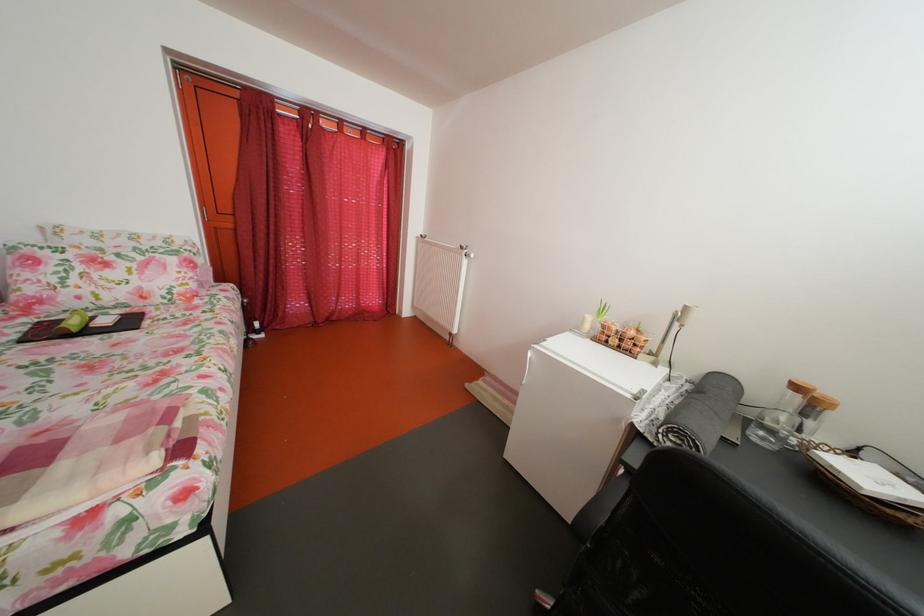
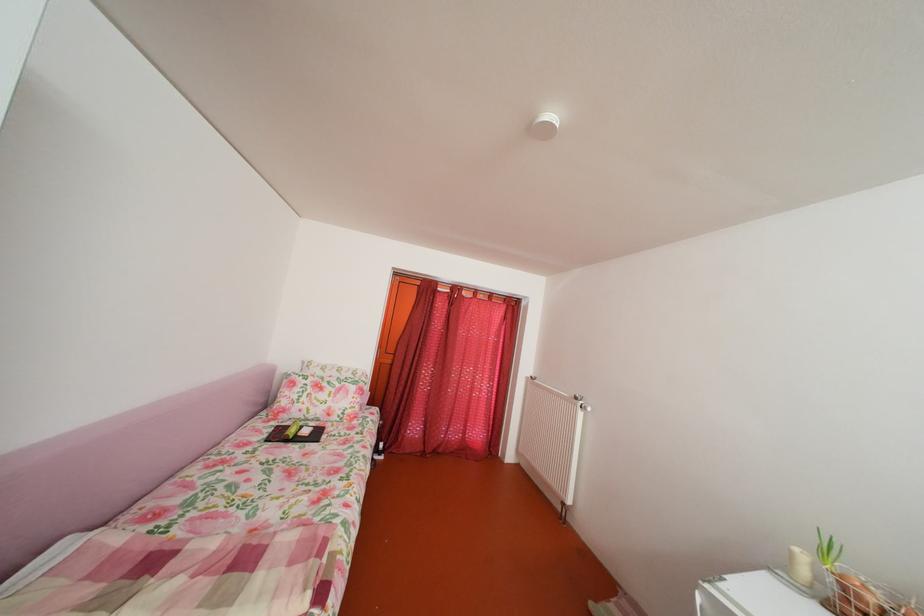
In the second image, find the point that corresponds to point 40,326 in the first image.

(286, 430)